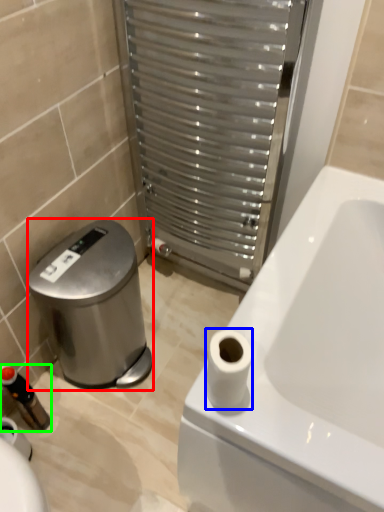
Question: Which object is positioned farthest from water cooler (highlighted by a red box)? Select from toilet paper (highlighted by a blue box) and toiletry (highlighted by a green box).

Choices:
 (A) toilet paper
 (B) toiletry

Answer: (A)